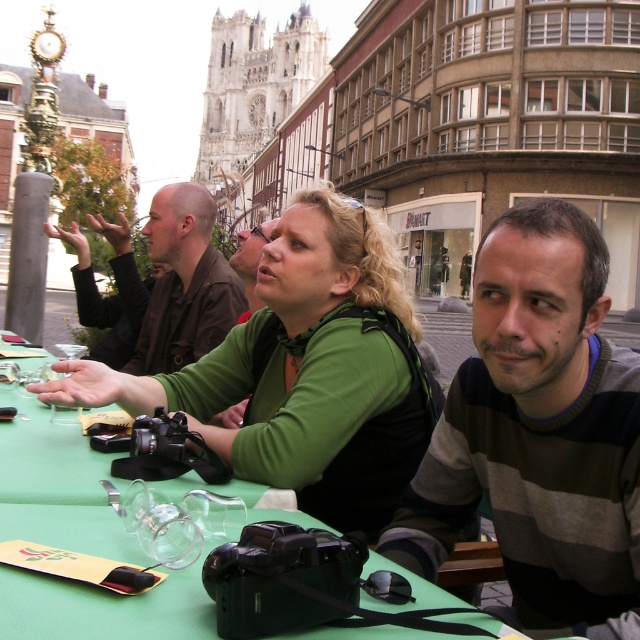
You are standing in the public square looking at the group of four people seated at the green table. There are two points marked in the image. The first point is at coordinate (419, 456) and the second is at (61, 419). Which point is closer to your eyes?

Point (419, 456) is further to the viewer than point (61, 419), so the point closer to your eyes is point (61, 419).

You are a photographer standing at the edge of the square. You want to take a photo of the green matte shirt at center and the transparent glass wine glass at center such that both are clearly visible in the frame. Considering their distance apart, is this feasible?

The green matte shirt at center and the transparent glass wine glass at center are 16.78 meters apart. Since this distance is quite large, it might be challenging to capture both clearly in a single frame unless using a wide angle lens or adjusting your position to ensure both are within the camera view.

You are standing at the entrance of the square and want to find the person wearing the green matte shirt at center. According to the image, where should you look relative to the Gothic cathedral in the background?

The green matte shirt at center is located at point (x=307, y=371), which means it is positioned approximately in the center of the image. Since the Gothic cathedral is in the background, you should look towards the middle area of the square facing the cathedral to find the person.